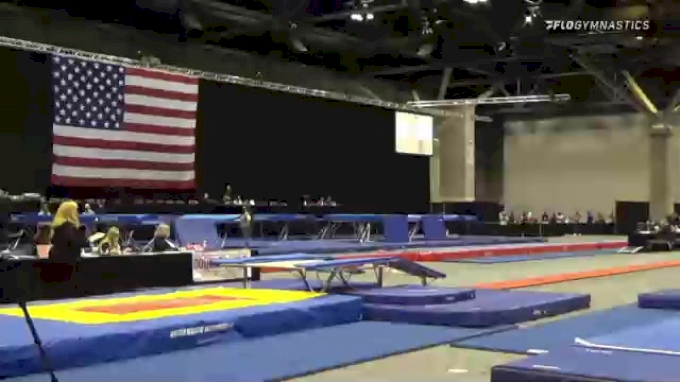
Locate an element on the screen. The height and width of the screenshot is (382, 680). black sheet is located at coordinates (303, 166).